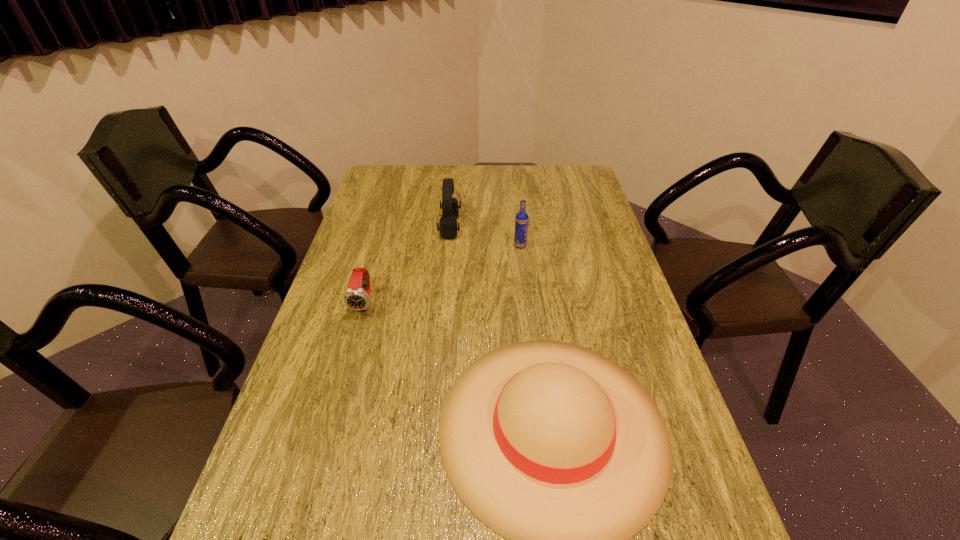
What are the coordinates of `vacant space that satisfies the following two spatial constraints: 1. on the headband of the second farthest object; 2. on the right side of the farthest object` in the screenshot? It's located at (448, 246).

Find the location of a particular element. This screenshot has width=960, height=540. free location that satisfies the following two spatial constraints: 1. on the headband of the vodka; 2. on the right side of the headset is located at coordinates (448, 246).

Where is `free location that satisfies the following two spatial constraints: 1. on the back side of the vodka; 2. on the headband of the farthest object`? free location that satisfies the following two spatial constraints: 1. on the back side of the vodka; 2. on the headband of the farthest object is located at coordinates (518, 227).